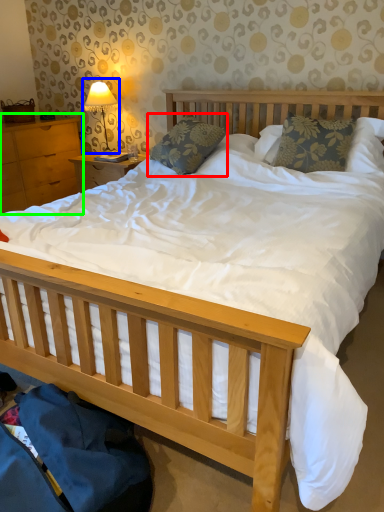
Question: Which object is positioned farthest from pillow (highlighted by a red box)? Select from table lamp (highlighted by a blue box) and nightstand (highlighted by a green box).

Choices:
 (A) table lamp
 (B) nightstand

Answer: (B)